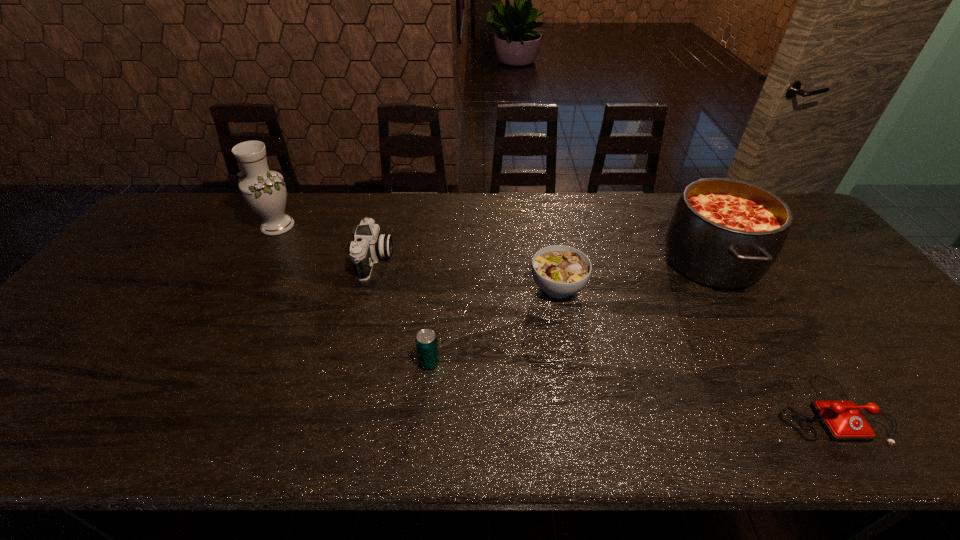
Where is `blank area located 0.230m on the right of the tallest object`? Image resolution: width=960 pixels, height=540 pixels. blank area located 0.230m on the right of the tallest object is located at coordinates (371, 226).

Image resolution: width=960 pixels, height=540 pixels. I want to click on vacant space situated on the front of the casserole, so click(x=820, y=446).

Find the location of a particular element. The image size is (960, 540). vacant area situated on the front of the third tallest object is located at coordinates (359, 320).

The image size is (960, 540). In order to click on free space located 0.130m on the front of the third object from left to right in this screenshot , I will do `click(423, 423)`.

Locate an element on the screen. free spot located 0.250m on the left of the fourth object from left to right is located at coordinates (439, 287).

Identify the location of vase at the far edge. (264, 190).

Where is `casserole that is positioned at the far edge`? The width and height of the screenshot is (960, 540). casserole that is positioned at the far edge is located at coordinates point(726,233).

The height and width of the screenshot is (540, 960). Identify the location of object located at the near edge. [x=842, y=420].

Find the location of `free space at the far edge`. free space at the far edge is located at coordinates (324, 197).

In the image, there is a desktop. Where is `vacant space at the near edge`? This screenshot has height=540, width=960. vacant space at the near edge is located at coordinates (882, 445).